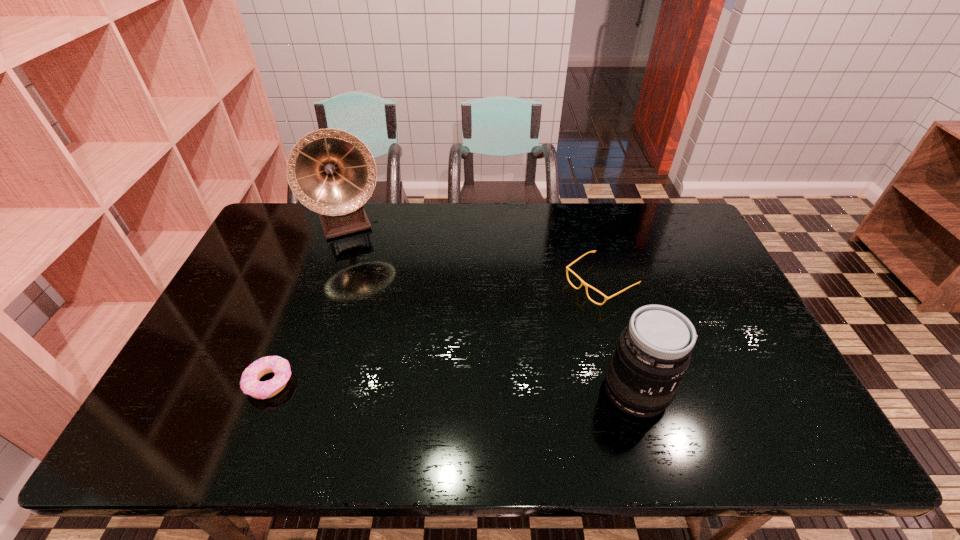
The height and width of the screenshot is (540, 960). Find the location of `free space located in front of the lenses of the spectacles`. free space located in front of the lenses of the spectacles is located at coordinates (488, 355).

Where is `free space located 0.250m on the horn of the tallest object`? free space located 0.250m on the horn of the tallest object is located at coordinates (377, 293).

Find the location of `vacant space located on the horn of the tallest object`. vacant space located on the horn of the tallest object is located at coordinates (372, 280).

The height and width of the screenshot is (540, 960). Identify the location of free location located on the horn of the tallest object. (388, 318).

You are a GUI agent. You are given a task and a screenshot of the screen. Output one action in this format:
    pyautogui.click(x=<x>, y=<y>)
    Task: Click on the object that is positioned at the far edge
    Image resolution: width=960 pixels, height=540 pixels.
    Given the screenshot: What is the action you would take?
    pyautogui.click(x=330, y=171)

You are a GUI agent. You are given a task and a screenshot of the screen. Output one action in this format:
    pyautogui.click(x=<x>, y=<y>)
    Task: Click on the doughnut present at the near edge
    The width and height of the screenshot is (960, 540).
    Given the screenshot: What is the action you would take?
    pyautogui.click(x=249, y=383)

Locate an element on the screen. The image size is (960, 540). telephoto lens that is at the near edge is located at coordinates (653, 352).

Where is `vacant region at the far edge of the desktop`? Image resolution: width=960 pixels, height=540 pixels. vacant region at the far edge of the desktop is located at coordinates (625, 243).

I want to click on free space at the near edge, so click(502, 405).

Where is `blank space at the left edge of the desktop`? The image size is (960, 540). blank space at the left edge of the desktop is located at coordinates (242, 362).